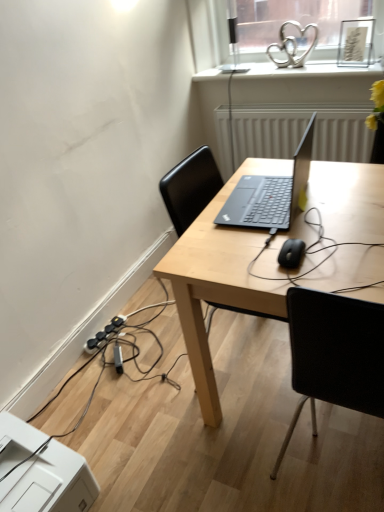
Where is `vacant space that is to the left of light wood desk at center`? The image size is (384, 512). vacant space that is to the left of light wood desk at center is located at coordinates (150, 409).